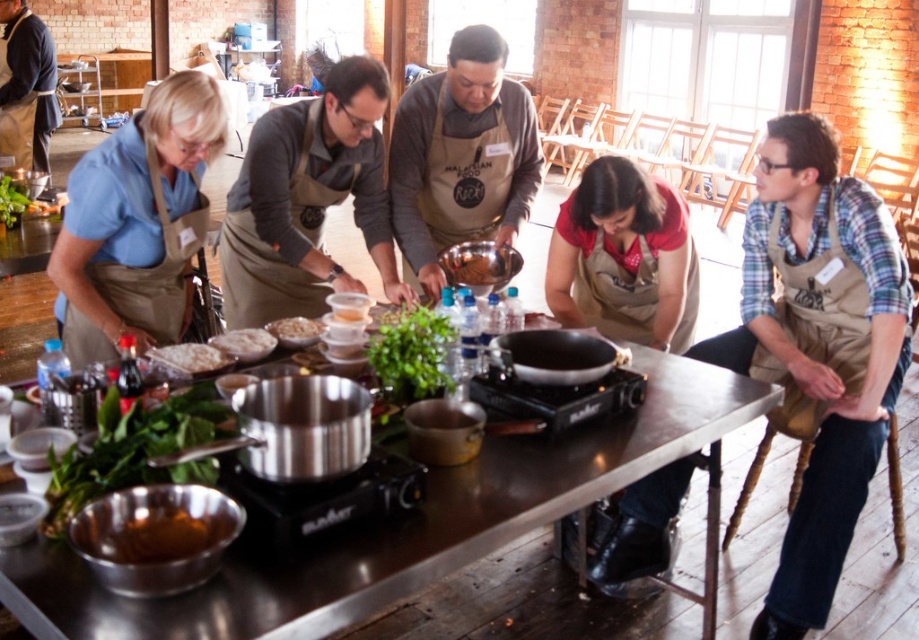
You are a guest at this cooking class and want to identify the instructor. Both the plaid cotton shirt at center and the red apron at center are visible. Which clothing item is closer to the top of the person?

The red apron at center is above the plaid cotton shirt at center since the plaid cotton shirt at center is positioned under the red apron at center.

You are a participant in the cooking class and need to measure the white powdery flour at center and the white flour at center for a recipe. Which one should you use if the recipe requires a larger quantity of flour?

You should use the white powdery flour at center because it is larger in size than the white flour at center, meaning it can hold more flour when measured.

You are a participant in the cooking class and need to retrieve an ingredient from the translucent plastic container at center. However, the dark blue shirt at upper left is blocking your path. Can you move around the container to the right side?

The dark blue shirt at upper left is to the left of the translucent plastic container at center, so you can move around to the right side of the container to access it without obstruction.